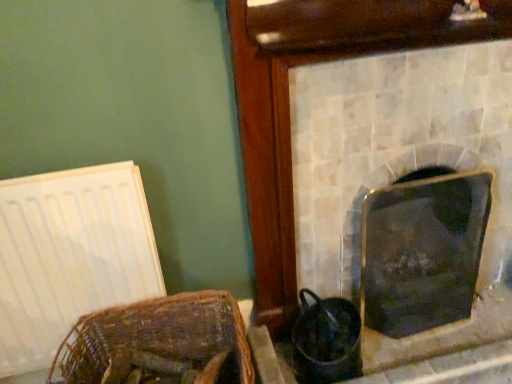
Question: From a real-world perspective, is shiny black glass at right, the second fireplace in the left-to-right sequence, under metallic silver fireplace at center, acting as the 1th fireplace starting from the left?

Choices:
 (A) yes
 (B) no

Answer: (A)

Question: From the image's perspective, would you say shiny black glass at right, the second fireplace in the left-to-right sequence, is shown under metallic silver fireplace at center, acting as the 1th fireplace starting from the left?

Choices:
 (A) yes
 (B) no

Answer: (A)

Question: From the image's perspective, does shiny black glass at right, the second fireplace in the left-to-right sequence, appear higher than metallic silver fireplace at center, which is the 2th fireplace in right-to-left order?

Choices:
 (A) no
 (B) yes

Answer: (A)

Question: Is shiny black glass at right, the 1th fireplace viewed from the right, surrounding metallic silver fireplace at center, which is the 2th fireplace in right-to-left order?

Choices:
 (A) yes
 (B) no

Answer: (B)

Question: Can you confirm if shiny black glass at right, the second fireplace in the left-to-right sequence, is positioned to the left of metallic silver fireplace at center, which is the 2th fireplace in right-to-left order?

Choices:
 (A) yes
 (B) no

Answer: (B)

Question: Would you say metallic silver fireplace at center, acting as the 1th fireplace starting from the left, is to the left or to the right of woven brown basket at lower left in the picture?

Choices:
 (A) right
 (B) left

Answer: (A)

Question: Considering the positions of metallic silver fireplace at center, acting as the 1th fireplace starting from the left, and woven brown basket at lower left in the image, is metallic silver fireplace at center, acting as the 1th fireplace starting from the left, bigger or smaller than woven brown basket at lower left?

Choices:
 (A) small
 (B) big

Answer: (B)

Question: From a real-world perspective, is metallic silver fireplace at center, which is the 2th fireplace in right-to-left order, above or below woven brown basket at lower left?

Choices:
 (A) below
 (B) above

Answer: (B)

Question: In terms of height, does metallic silver fireplace at center, which is the 2th fireplace in right-to-left order, look taller or shorter compared to woven brown basket at lower left?

Choices:
 (A) short
 (B) tall

Answer: (B)

Question: Considering the positions of point (484, 301) and point (409, 183), is point (484, 301) closer or farther from the camera than point (409, 183)?

Choices:
 (A) farther
 (B) closer

Answer: (A)

Question: From their relative heights in the image, would you say metallic silver fireplace at center, which is the 2th fireplace in right-to-left order, is taller or shorter than shiny black glass at right, the second fireplace in the left-to-right sequence?

Choices:
 (A) tall
 (B) short

Answer: (A)

Question: Looking at their shapes, would you say metallic silver fireplace at center, which is the 2th fireplace in right-to-left order, is wider or thinner than shiny black glass at right, the second fireplace in the left-to-right sequence?

Choices:
 (A) wide
 (B) thin

Answer: (B)

Question: From the image's perspective, is metallic silver fireplace at center, which is the 2th fireplace in right-to-left order, above or below shiny black glass at right, the second fireplace in the left-to-right sequence?

Choices:
 (A) above
 (B) below

Answer: (A)

Question: Considering the positions of point (236, 355) and point (499, 314), is point (236, 355) closer or farther from the camera than point (499, 314)?

Choices:
 (A) closer
 (B) farther

Answer: (A)

Question: From a real-world perspective, is woven brown basket at lower left physically located above or below metallic silver fireplace at center, acting as the 1th fireplace starting from the left?

Choices:
 (A) above
 (B) below

Answer: (B)